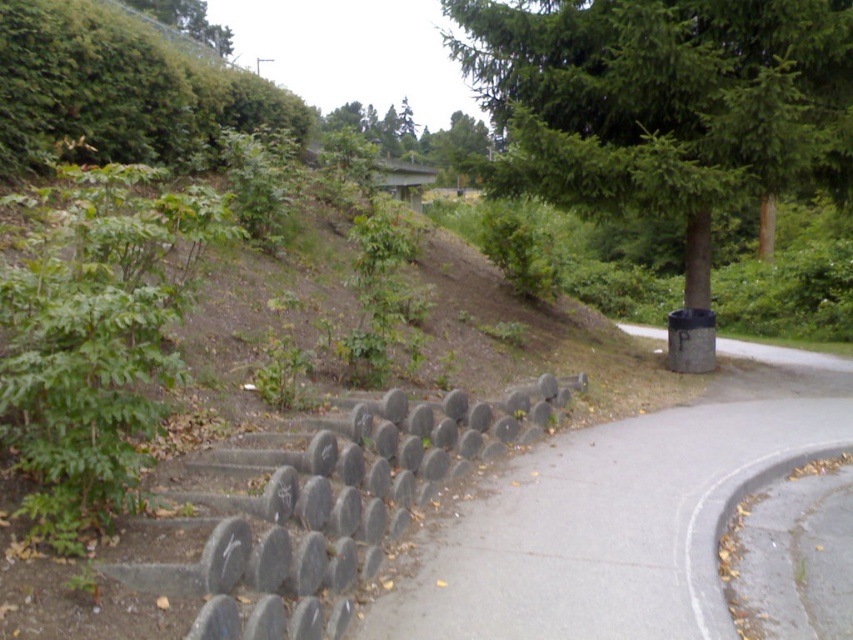
You are standing at the point labeled point (662, 104) in the image. What is the nearest object to you in the scene?

The nearest object to point (662, 104) is the green textured tree at upper right since the point is located on it.

You are a gardener planning to plant flowers along the gray concrete pavement at lower left and the green leafy tree at center. Which area requires more space due to its size?

The green leafy tree at center requires more space because its width is greater than the gray concrete pavement at lower left.

Based on the photo, you are a gardener planning to trim the green textured tree at upper right and check the gray concrete barrier at center. Based on their positions, which object should you attend to first if you are facing the image from the front?

The gray concrete barrier at center is to the left of the green textured tree at upper right, so you should attend to the gray concrete barrier at center first since it is closer to your left side when facing the image.